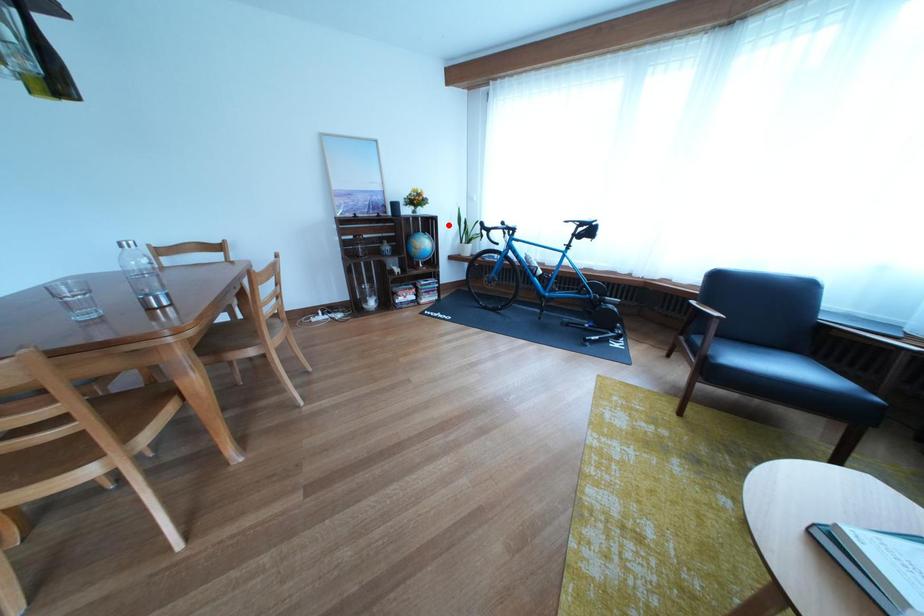
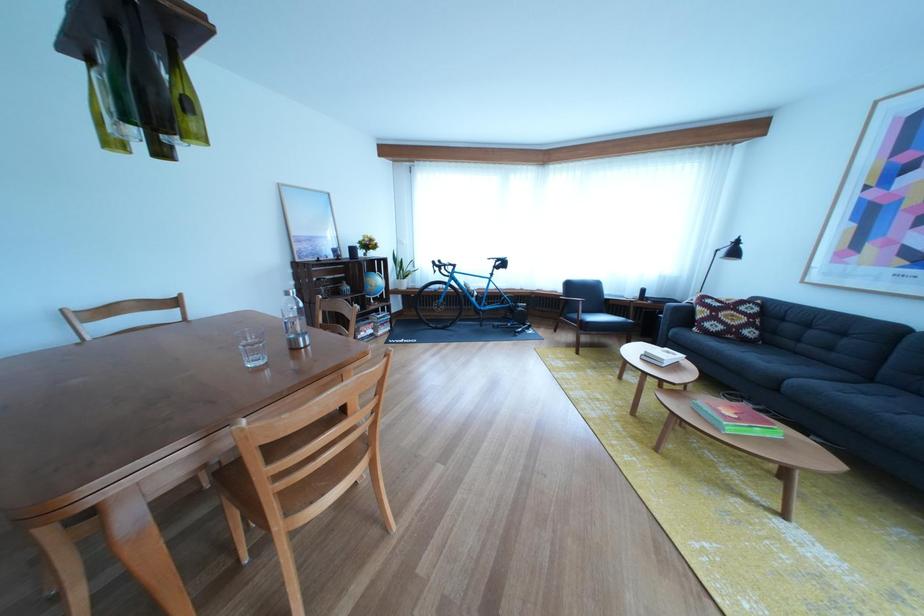
In the second image, find the point that corresponds to the highlighted location in the first image.

(398, 265)